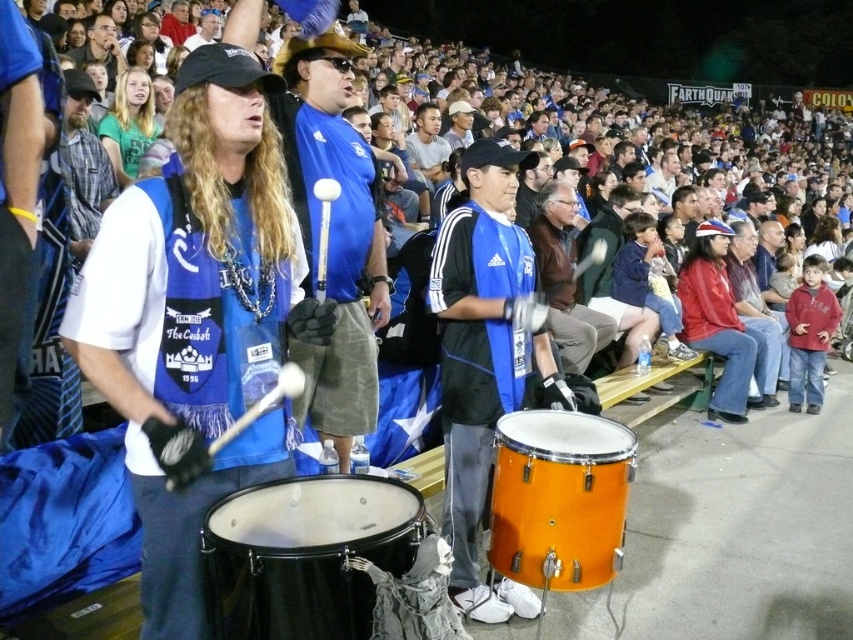
Question: Is orange wood drum at center to the right of brown leather jacket at center from the viewer's perspective?

Choices:
 (A) yes
 (B) no

Answer: (B)

Question: Which object is farther from the camera taking this photo?

Choices:
 (A) blue jersey at center
 (B) light brown hair at upper center
 (C) orange drum at center

Answer: (B)

Question: Is black drum at center to the right of red leather jacket at right from the viewer's perspective?

Choices:
 (A) yes
 (B) no

Answer: (B)

Question: Which object appears farthest from the camera in this image?

Choices:
 (A) light brown hair at upper center
 (B) red leather jacket at right
 (C) black drum at center
 (D) brown leather jacket at center

Answer: (B)

Question: Which point is farther to the camera?

Choices:
 (A) (570, 220)
 (B) (314, 552)

Answer: (A)

Question: Can you confirm if orange drum at center is positioned to the left of black drum at center?

Choices:
 (A) no
 (B) yes

Answer: (A)